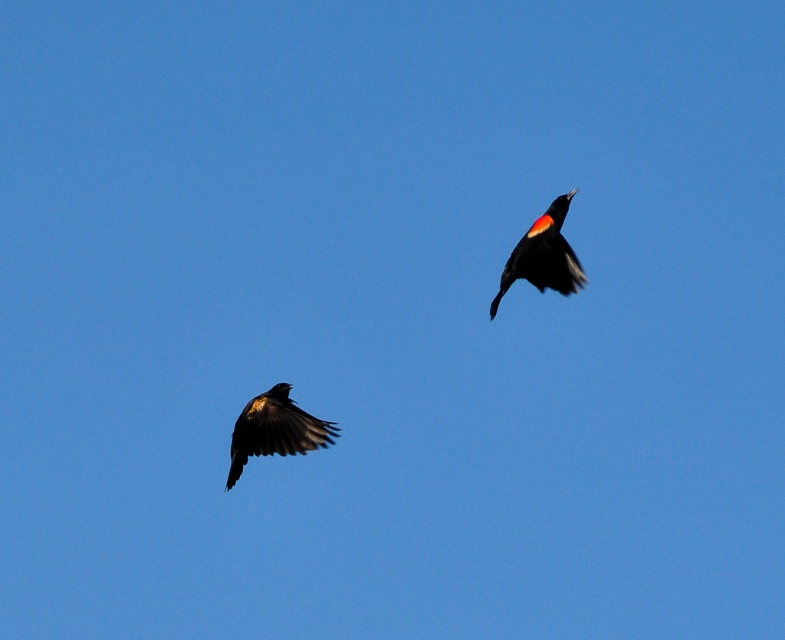
You are an ornithologist observing two shiny black birds in flight. You notice the shiny black bird at lower left and the shiny black bird at upper right. Which of these two birds appears to be closer to you based on their relative heights in the image?

The shiny black bird at upper right appears closer because it has a greater height in the image compared to the shiny black bird at lower left, which is smaller and likely farther away.

You are an ornithologist observing two shiny black birds in the sky. You notice the shiny black bird at lower left and the shiny black bird at upper right. Which of these two birds is positioned more to the left in the image?

The shiny black bird at lower left is positioned more to the left than the shiny black bird at upper right.

You are observing two birds in the sky. You see a shiny black bird at lower left and another bird. Which bird is closer to the camera?

The shiny black bird at lower left is farther from the camera because it is positioned lower in the frame and appears slightly smaller, which typically indicates greater distance in such compositions.